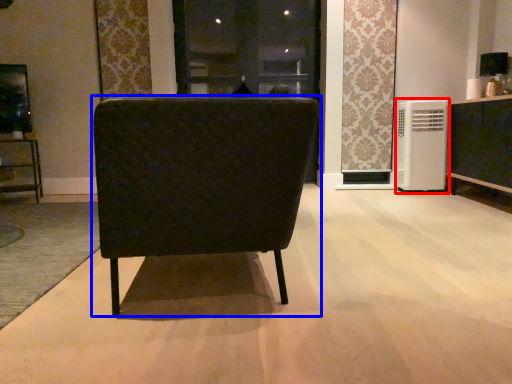
Question: Which of the following is the closest to the observer, air conditioner (highlighted by a red box) or chair (highlighted by a blue box)?

Choices:
 (A) air conditioner
 (B) chair

Answer: (B)